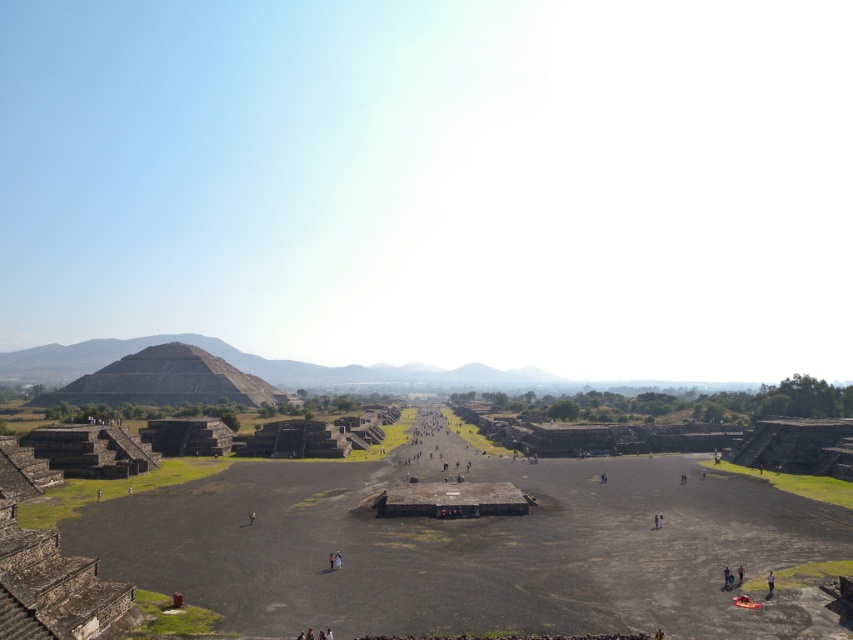
Is gray stone pyramid at center-left behind blurred fabric person at lower right?

Yes, it is behind blurred fabric person at lower right.

Who is shorter, gray stone pyramid at center-left or blurred fabric person at lower right?

Standing shorter between the two is blurred fabric person at lower right.

What do you see at coordinates (165, 380) in the screenshot? The width and height of the screenshot is (853, 640). I see `gray stone pyramid at center-left` at bounding box center [165, 380].

Locate an element on the screen. The height and width of the screenshot is (640, 853). gray stone pyramid at center-left is located at coordinates click(165, 380).